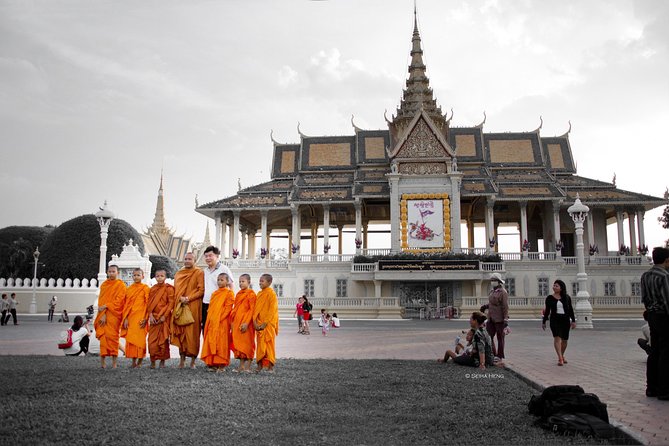
Locate an element on the screen. light is located at coordinates (104, 228).